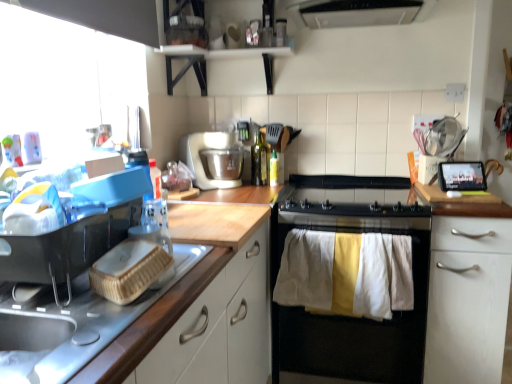
In order to click on free point above white matte cabinet at right, arranged as the 1th cabinetry when viewed from the right (from a real-world perspective) in this screenshot , I will do `click(467, 193)`.